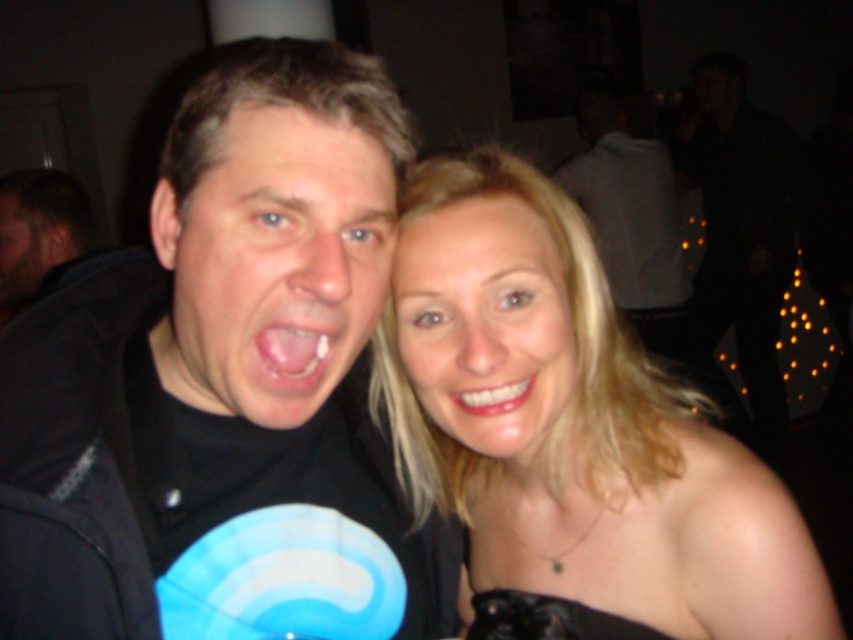
Based on the scene description, can you determine if the matte black face at center is wider than the white glossy teeth at center?

The matte black face at center is wider than white glossy teeth at center according to the description.